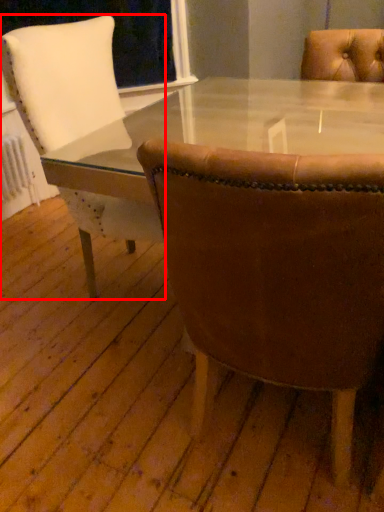
Question: Observing the image, what is the correct spatial positioning of chair (annotated by the red box) in reference to chair?

Choices:
 (A) left
 (B) right

Answer: (A)